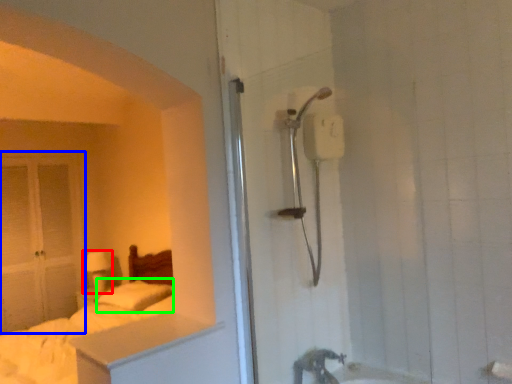
Question: Based on their relative distances, which object is nearer to lamp (highlighted by a red box)? Choose from glass door (highlighted by a blue box) and pillow (highlighted by a green box).

Choices:
 (A) glass door
 (B) pillow

Answer: (A)